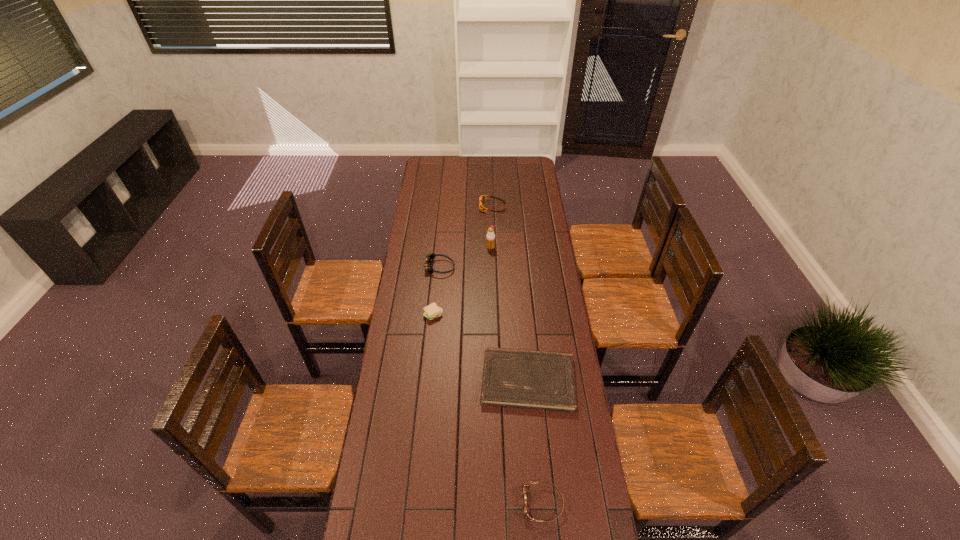
You are a GUI agent. You are given a task and a screenshot of the screen. Output one action in this format:
    pyautogui.click(x=<x>, y=<y>)
    Task: Click on the vacant space that is in between the paperback book and the fourth nearest object
    
    Given the screenshot: What is the action you would take?
    pyautogui.click(x=483, y=323)

Identify the location of free spot between the second nearest object and the second tallest object. (483, 323).

The image size is (960, 540). What are the coordinates of `empty space that is in between the farthest object and the patty` in the screenshot? It's located at (463, 261).

Find the location of a particular element. This screenshot has width=960, height=540. free space between the fifth shortest object and the third nearest object is located at coordinates (436, 291).

Locate an element on the screen. This screenshot has height=540, width=960. vacant area between the patty and the second nearest object is located at coordinates point(481,347).

This screenshot has width=960, height=540. Identify the location of free space between the patty and the nearest object. (488, 409).

Identify which object is the second nearest to the nearest goggles. Please provide its 2D coordinates. Your answer should be formatted as a tuple, i.e. [(x, y)], where the tuple contains the x and y coordinates of a point satisfying the conditions above.

[(432, 311)]

Select which object appears as the closest to the nearest goggles. Please provide its 2D coordinates. Your answer should be formatted as a tuple, i.e. [(x, y)], where the tuple contains the x and y coordinates of a point satisfying the conditions above.

[(545, 380)]

Locate an element on the screen. The width and height of the screenshot is (960, 540). goggles that is the closest to the fourth farthest object is located at coordinates (429, 258).

Identify the location of goggles that is the closest to the icecream. (429, 258).